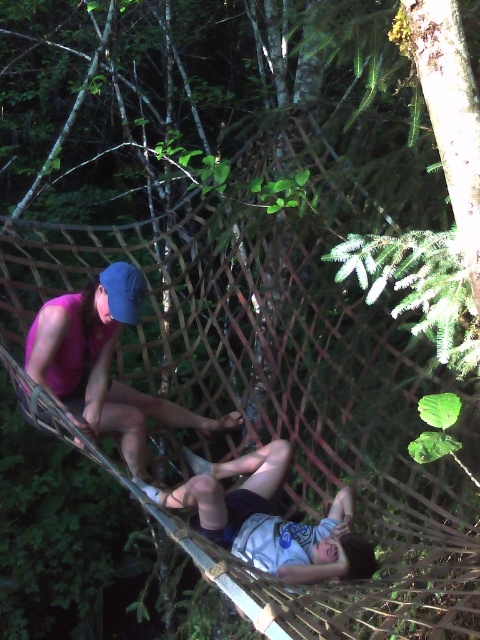
Does matte pink shorts at center appear over white cotton shirt at center?

Yes, matte pink shorts at center is above white cotton shirt at center.

Is point (81, 417) farther from viewer compared to point (288, 550)?

Yes.

The width and height of the screenshot is (480, 640). Identify the location of matte pink shorts at center. (101, 364).